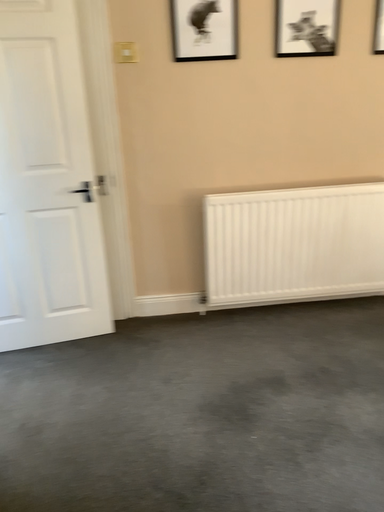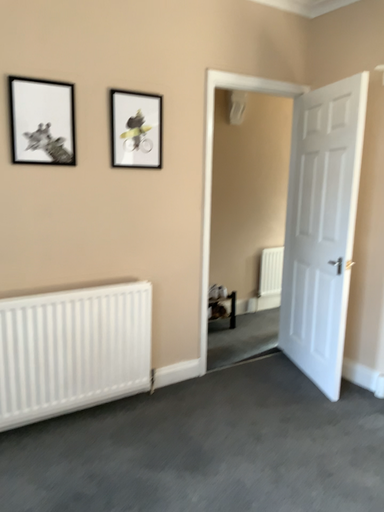
Question: Which way did the camera rotate in the video?

Choices:
 (A) rotated downward
 (B) rotated upward

Answer: (B)